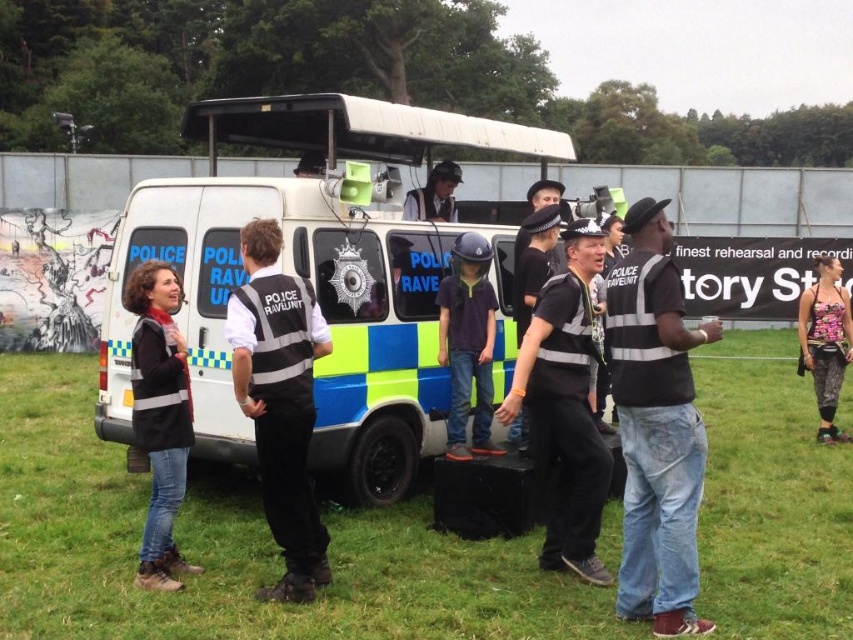
Question: Does black matte jacket at left have a greater width compared to dark blue uniform at center?

Choices:
 (A) no
 (B) yes

Answer: (A)

Question: Does green grass at lower center appear on the left side of black matte jacket at left?

Choices:
 (A) yes
 (B) no

Answer: (B)

Question: Does black reflective vest at center have a larger size compared to black matte jacket at left?

Choices:
 (A) yes
 (B) no

Answer: (A)

Question: Among these objects, which one is nearest to the camera?

Choices:
 (A) black matte jacket at left
 (B) camouflage leggings at center

Answer: (A)

Question: Among these points, which one is farthest from the camera?

Choices:
 (A) (640, 600)
 (B) (602, 614)
 (C) (798, 321)
 (D) (358, 454)

Answer: (C)

Question: Which of the following is the closest to the observer?

Choices:
 (A) (500, 273)
 (B) (820, 285)
 (C) (144, 304)

Answer: (C)